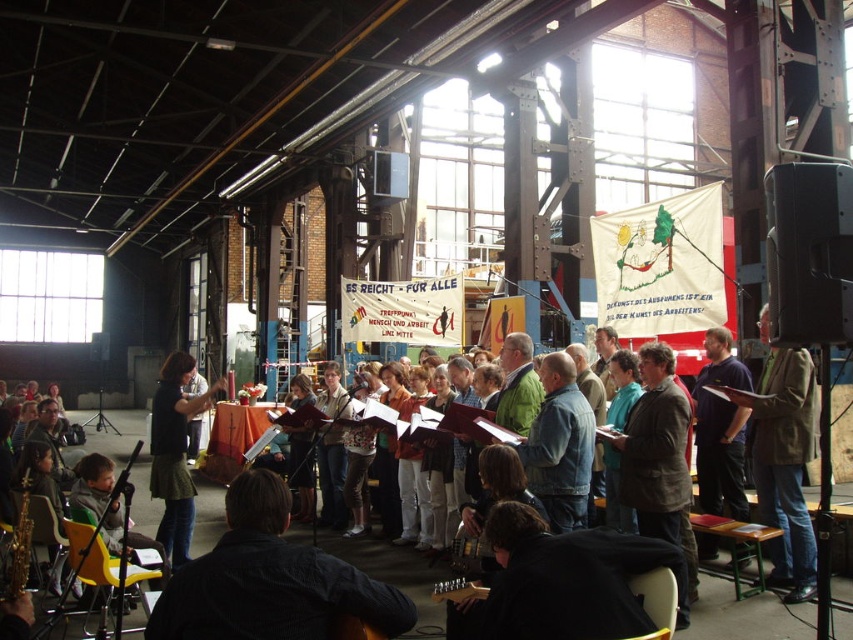
You are an event planner arranging seating for attendees. You need to place a chair that is 1 meter tall. Will the chair fit between the brown leather jacket at right and the green fabric skirt at center without touching either?

The brown leather jacket at right has a lesser height compared to green fabric skirt at center. Since the chair is 1 meter tall, and the jacket is shorter than the skirt, but the exact heights arenanot provided, we cannot determine if the chair will fit without additional information.

You are a photographer standing at the back of the hall. You want to take a photo that includes both the dark blue shirt at center and the green fabric skirt at center. Considering their distance, will they both fit in your camera frame if your camera has a 5 meter field of view?

The dark blue shirt at center and green fabric skirt at center are 7.88 meters apart, which exceeds the camera field of view of 5 meters. Therefore, both cannot fit in the frame simultaneously.

You are a photographer at the event and want to take a photo of both the dark blue shirt at center and the green fabric skirt at center. Since you can only focus on one person at a time, which person should you focus on first to ensure both are in the frame?

You should focus on the green fabric skirt at center first because the dark blue shirt at center is to the right of it, so by starting with the leftmost subject, you can ensure both are included in the frame.